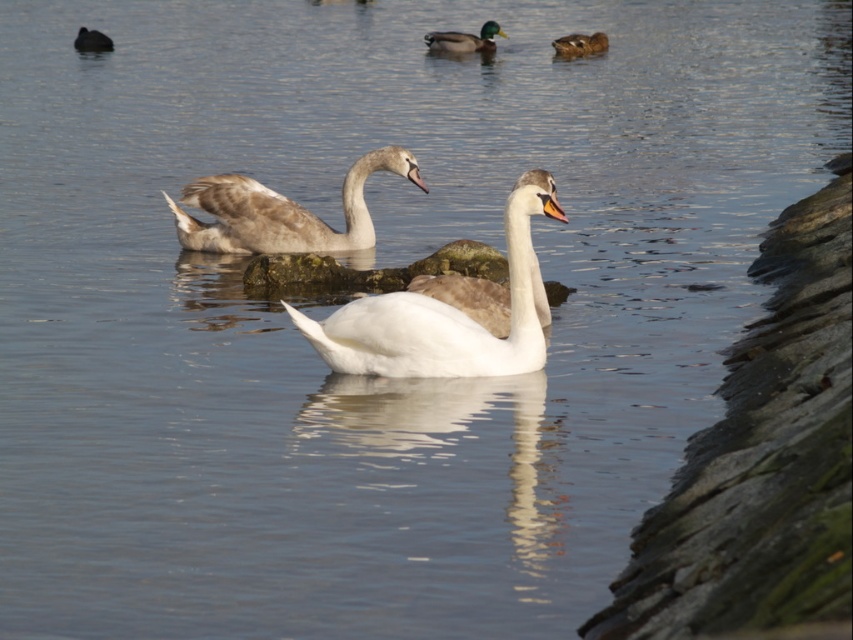
Question: Can you confirm if brown feathered swan at center is positioned to the left of brown glossy duck at upper center?

Choices:
 (A) no
 (B) yes

Answer: (B)

Question: Which object is closer to the camera taking this photo?

Choices:
 (A) green glossy duck at upper center
 (B) brown feathered swan at center
 (C) dark gray matte duck at upper left

Answer: (B)

Question: Is green glossy duck at upper center below brown glossy duck at upper center?

Choices:
 (A) no
 (B) yes

Answer: (A)

Question: Which point is closer to the camera?

Choices:
 (A) dark gray matte duck at upper left
 (B) green glossy duck at upper center
 (C) brown glossy duck at upper center
 (D) white glossy swan at center

Answer: (D)

Question: Which is farther from the white glossy swan at center?

Choices:
 (A) brown feathered swan at center
 (B) dark gray matte duck at upper left
 (C) brown glossy duck at upper center
 (D) green glossy duck at upper center

Answer: (B)

Question: Is green glossy duck at upper center thinner than brown glossy duck at upper center?

Choices:
 (A) no
 (B) yes

Answer: (A)